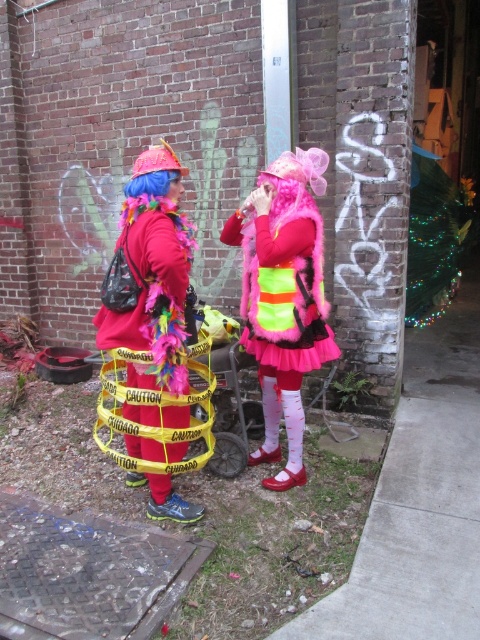
Which of these two, neon yellow fabric skirt at center or shiny metallic hoop at center, stands taller?

neon yellow fabric skirt at center

Based on the photo, does neon yellow fabric skirt at center have a larger size compared to shiny metallic hoop at center?

Indeed, neon yellow fabric skirt at center has a larger size compared to shiny metallic hoop at center.

You are a GUI agent. You are given a task and a screenshot of the screen. Output one action in this format:
    pyautogui.click(x=<x>, y=<y>)
    Task: Click on the neon yellow fabric skirt at center
    The height and width of the screenshot is (640, 480).
    Given the screenshot: What is the action you would take?
    pyautogui.click(x=284, y=298)